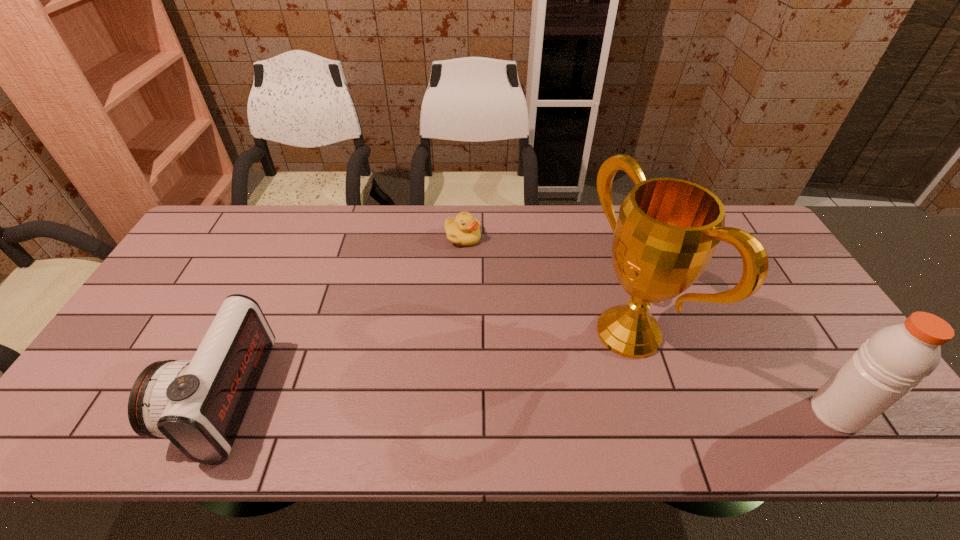
Locate an element on the screen. Image resolution: width=960 pixels, height=540 pixels. free space that satisfies the following two spatial constraints: 1. on the front side of the tallest object; 2. on the left side of the second tallest object is located at coordinates [x=653, y=413].

This screenshot has height=540, width=960. In order to click on vacant space that satisfies the following two spatial constraints: 1. on the front side of the award; 2. on the left side of the duckling in this screenshot , I will do `click(459, 332)`.

This screenshot has width=960, height=540. Identify the location of free space that satisfies the following two spatial constraints: 1. on the front side of the third object from right to left; 2. on the left side of the shaker. (455, 413).

The width and height of the screenshot is (960, 540). What are the coordinates of `free space that satisfies the following two spatial constraints: 1. on the front side of the second tallest object; 2. on the left side of the farthest object` in the screenshot? It's located at (455, 413).